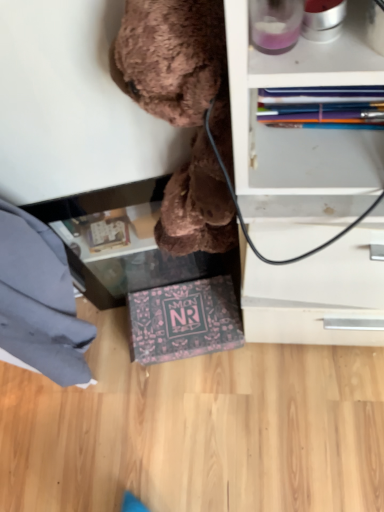
Question: Considering the positions of dark blue fabric at lower left and brown plush toy at upper center in the image, is dark blue fabric at lower left wider or thinner than brown plush toy at upper center?

Choices:
 (A) wide
 (B) thin

Answer: (A)

Question: In the image, is dark blue fabric at lower left on the left side or the right side of brown plush toy at upper center?

Choices:
 (A) left
 (B) right

Answer: (A)

Question: Estimate the real-world distances between objects in this image. Which object is farther from the brown plush toy at upper center?

Choices:
 (A) transparent glass table at lower center
 (B) dark blue fabric at lower left

Answer: (B)

Question: Estimate the real-world distances between objects in this image. Which object is farther from the brown plush toy at upper center?

Choices:
 (A) dark blue fabric at lower left
 (B) transparent glass table at lower center

Answer: (A)